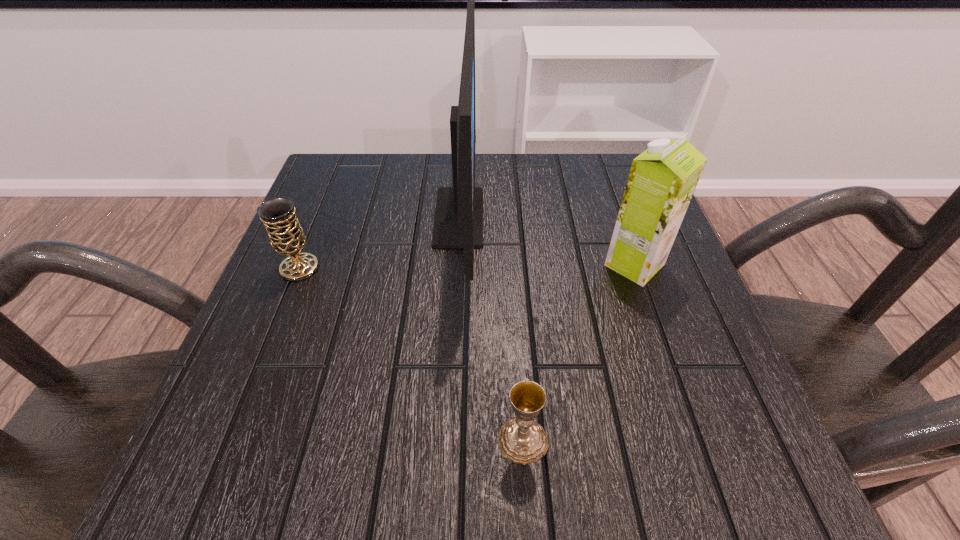
Find the location of `vacant region located 0.070m on the back of the third tallest object`. vacant region located 0.070m on the back of the third tallest object is located at coordinates (314, 232).

Locate an element on the screen. free space located 0.160m on the left of the nearest object is located at coordinates (385, 440).

This screenshot has width=960, height=540. What are the coordinates of `object that is at the far edge` in the screenshot? It's located at (458, 223).

At what (x,y) coordinates should I click in order to perform the action: click on object present at the near edge. Please return your answer as a coordinate pair (x, y). The image size is (960, 540). Looking at the image, I should click on (522, 440).

Locate an element on the screen. object present at the left edge is located at coordinates (286, 236).

What are the coordinates of `object that is at the right edge` in the screenshot? It's located at (662, 180).

The width and height of the screenshot is (960, 540). I want to click on free spot at the far edge of the desktop, so click(x=396, y=159).

This screenshot has width=960, height=540. In the image, there is a desktop. Identify the location of vacant space at the near edge. [x=433, y=481].

Image resolution: width=960 pixels, height=540 pixels. Identify the location of vacant space at the left edge of the desktop. (278, 335).

I want to click on vacant space at the right edge of the desktop, so click(638, 289).